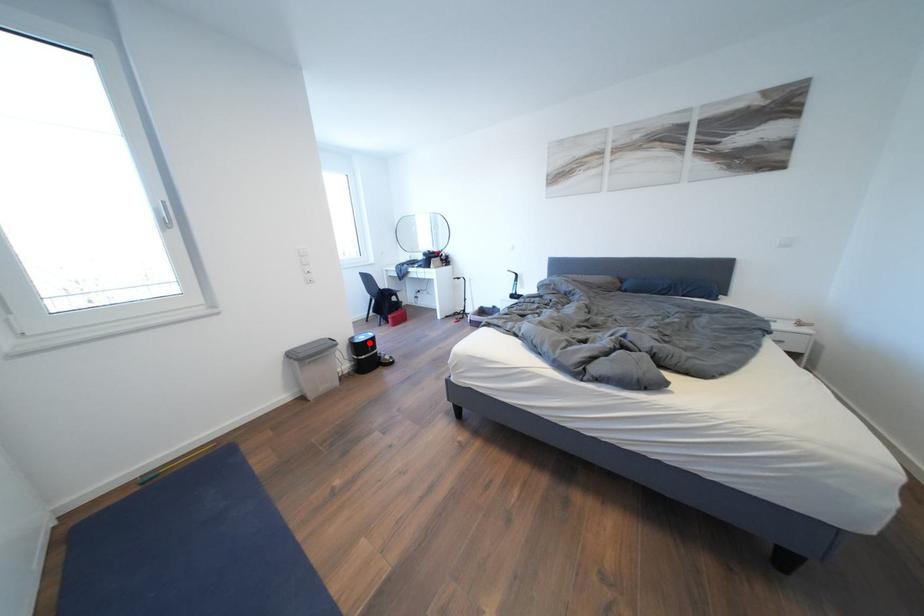
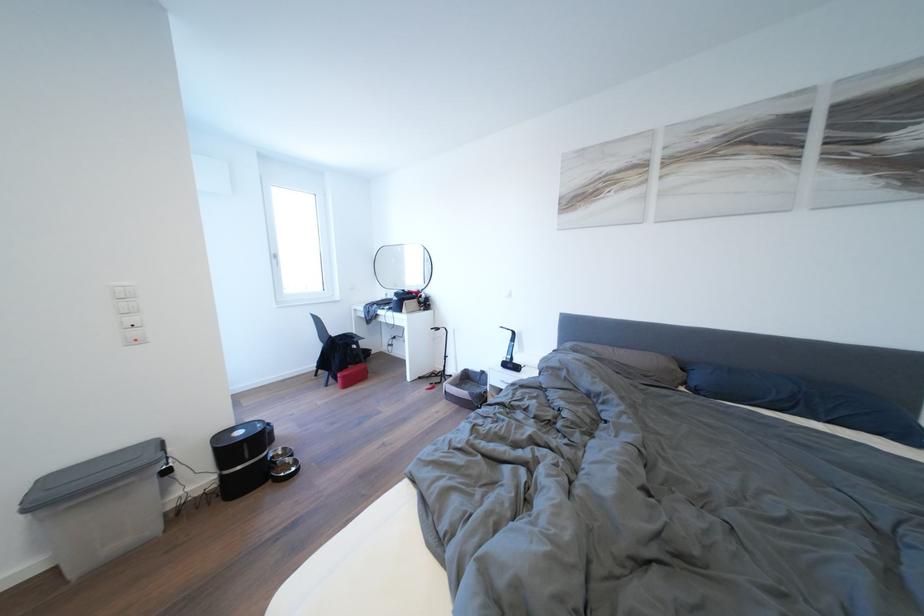
In the second image, find the point that corresponds to the highlighted location in the first image.

(248, 438)